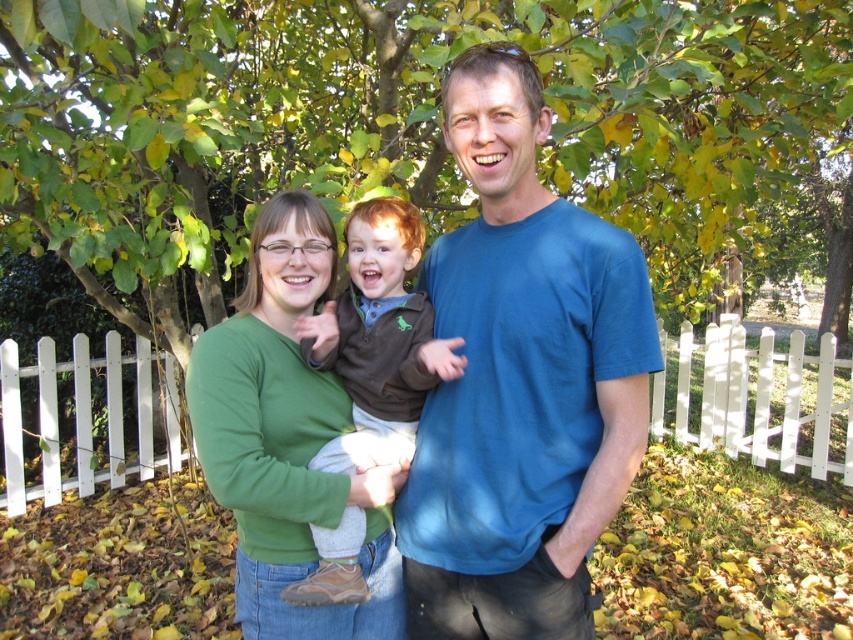
Question: Based on their relative distances, which object is farther from the white picket fence at center?

Choices:
 (A) brown suede boot at center
 (B) blue cotton t-shirt at center
 (C) green matte sweater at center

Answer: (B)

Question: Which object appears closest to the camera in this image?

Choices:
 (A) brown suede boot at center
 (B) green matte sweater at center
 (C) blue cotton t-shirt at center

Answer: (C)

Question: Does white picket fence at center have a larger size compared to brown suede boot at center?

Choices:
 (A) yes
 (B) no

Answer: (A)

Question: Which point is farther from the camera taking this photo?

Choices:
 (A) (300, 236)
 (B) (328, 362)
 (C) (39, 362)

Answer: (C)

Question: Is blue cotton t-shirt at center to the left of green matte sweater at center from the viewer's perspective?

Choices:
 (A) no
 (B) yes

Answer: (A)

Question: Is white picket fence at center above brown suede boot at center?

Choices:
 (A) no
 (B) yes

Answer: (A)